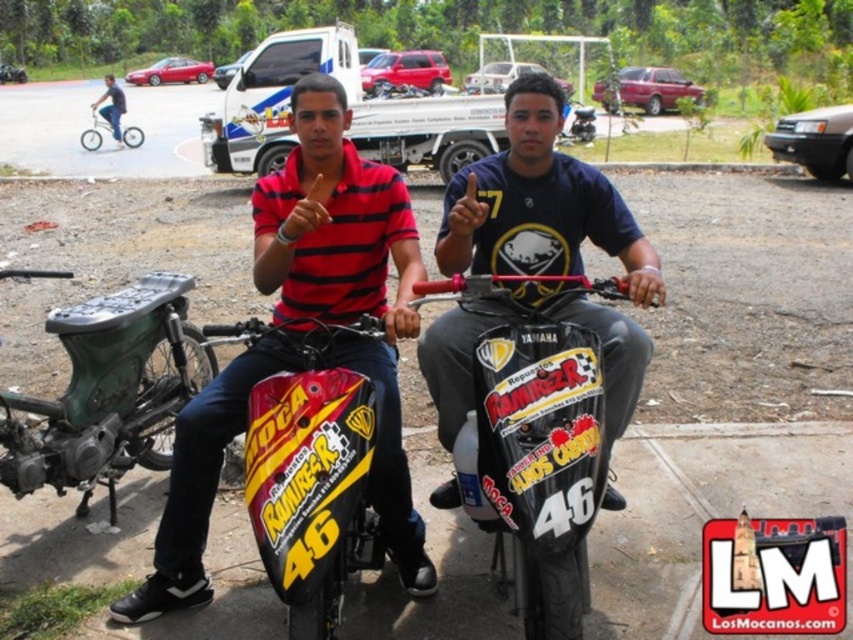
Does black matte motorcycle at center appear on the right side of shiny red motorcycle at center?

Correct, you'll find black matte motorcycle at center to the right of shiny red motorcycle at center.

Is point (560, 400) more distant than point (299, 456)?

Yes.

Identify the location of black matte motorcycle at center. The width and height of the screenshot is (853, 640). (534, 442).

Does black matte shirt at center appear on the right side of blue jeans at lower left?

Correct, you'll find black matte shirt at center to the right of blue jeans at lower left.

Does black matte shirt at center have a smaller size compared to blue jeans at lower left?

Yes.

Identify the location of black matte shirt at center. (538, 204).

Consider the image. Is shiny red motorcycle at center closer to the viewer compared to blue jeans at lower left?

That is True.

Does shiny red motorcycle at center appear under blue jeans at lower left?

Correct, shiny red motorcycle at center is located below blue jeans at lower left.

Where is `shiny red motorcycle at center`? shiny red motorcycle at center is located at coordinates (310, 470).